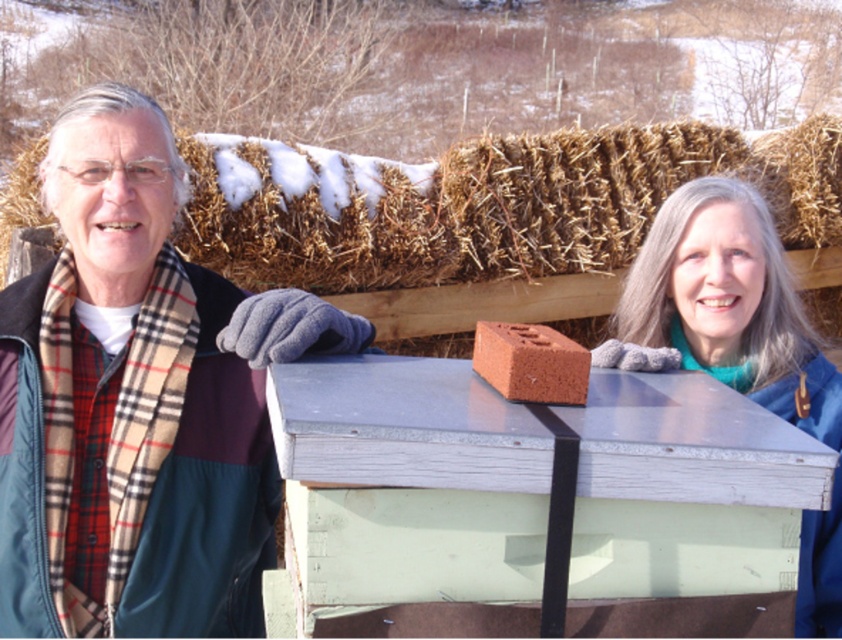
You are a photographer trying to capture the plaid scarf at left and the smooth gray wood crate at center in the same frame. Which object should you focus on first to ensure both are in focus?

The smooth gray wood crate at center should be focused on first because the plaid scarf at left is above it, so focusing on the lower object ensures both are within the depth of field.

You are a construction worker planning to stack more materials. You see the brown straw bale at upper center and the red clay brick at center. Which object is positioned higher in the image?

The brown straw bale at upper center is located above the red clay brick at center, so it is positioned higher in the image.